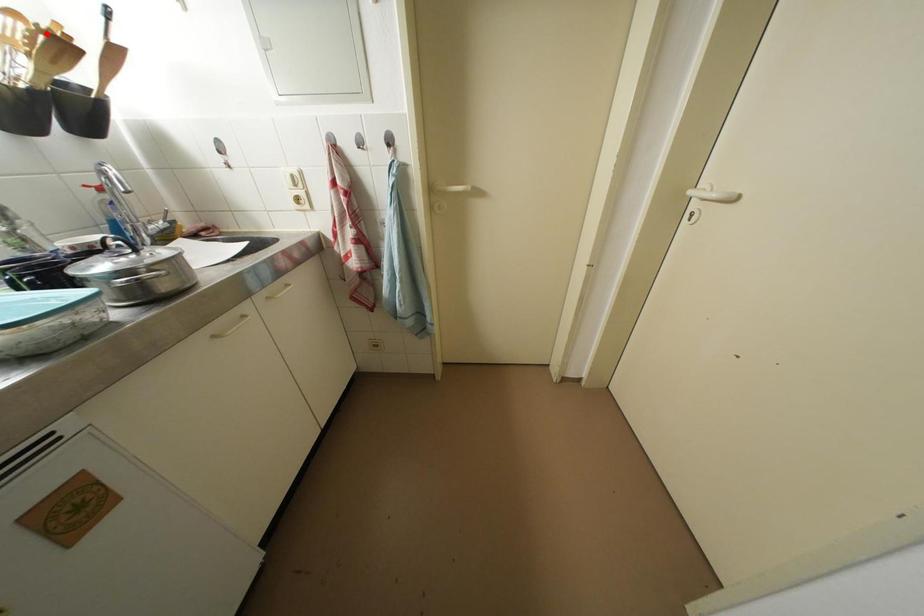
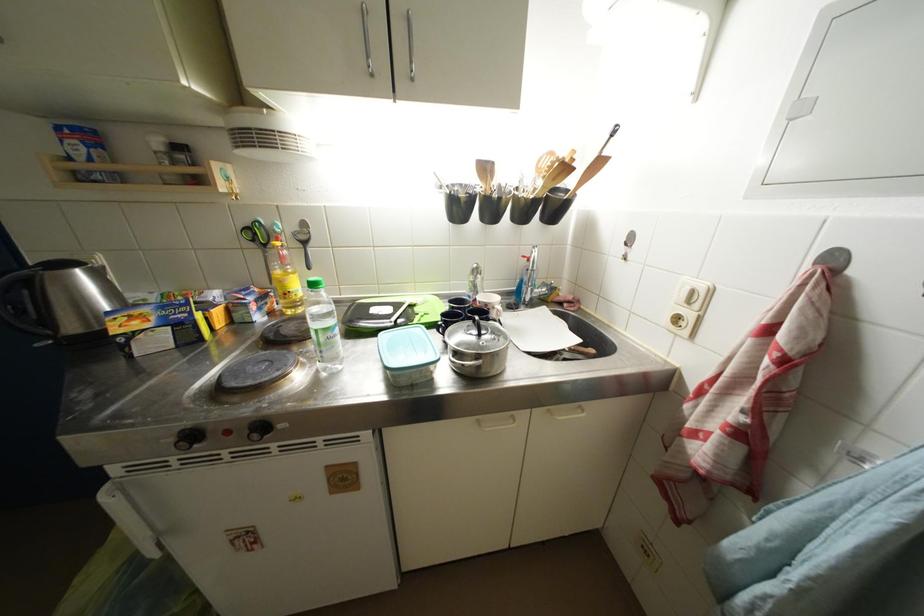
Where in the second image is the point corresponding to the highlighted location from the first image?

(565, 164)